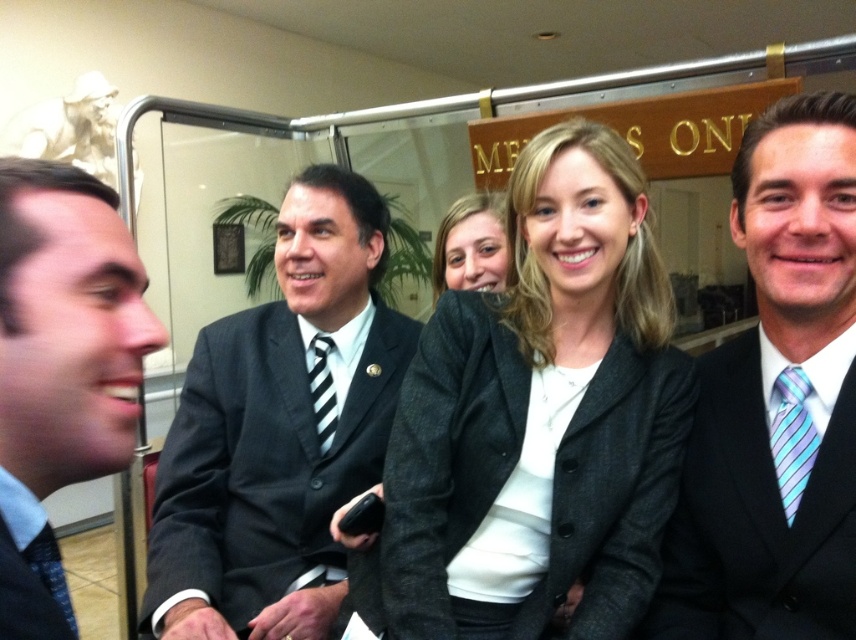
Based on the scene description, where is the striped silk tie at right located in the image?

The striped silk tie at right is located at point (x=792, y=436).

You are standing in front of the group and want to determine which of the two points, point (223, 394) or point (12, 545), is closer to you. Based on the scene description, which point is nearer?

Point (223, 394) is further to the viewer than point (12, 545). Therefore, point (223, 394) is closer to you.

You are a photographer adjusting your camera settings. You notice two points in the image at coordinates point [771,339] and point [483,253]. Which point should you focus on to ensure it appears clearer in the photo?

Point [771,339] should be focused on because it is closer to the camera and will appear clearer in the photo than point [483,253].